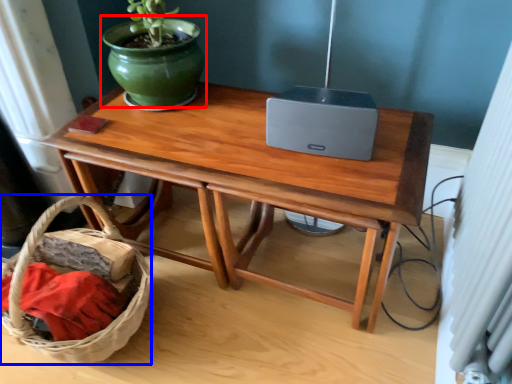
Question: Which object is closer to the camera taking this photo, flowerpot (highlighted by a red box) or basket (highlighted by a blue box)?

Choices:
 (A) flowerpot
 (B) basket

Answer: (B)